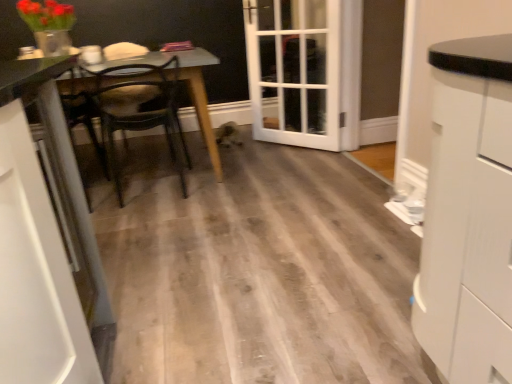
This screenshot has width=512, height=384. In order to click on unoccupied area in front of white glass door at center in this screenshot , I will do `click(298, 157)`.